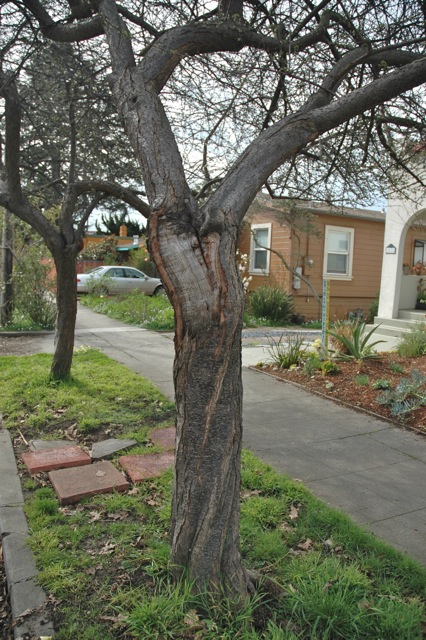
At what (x,y) coordinates should I click in order to perform the action: click on potted plant. Please return your answer as a coordinate pair (x, y). Looking at the image, I should click on (406, 272), (420, 301), (416, 271).